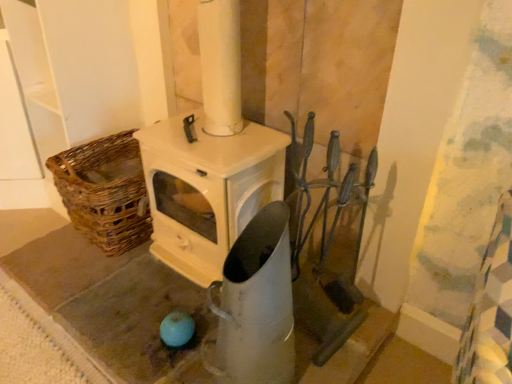
Where is `white matte pot at center`? This screenshot has height=384, width=512. white matte pot at center is located at coordinates (257, 304).

What do you see at coordinates (257, 304) in the screenshot? I see `white matte pot at center` at bounding box center [257, 304].

Find the location of `white matte pot at center`. white matte pot at center is located at coordinates (257, 304).